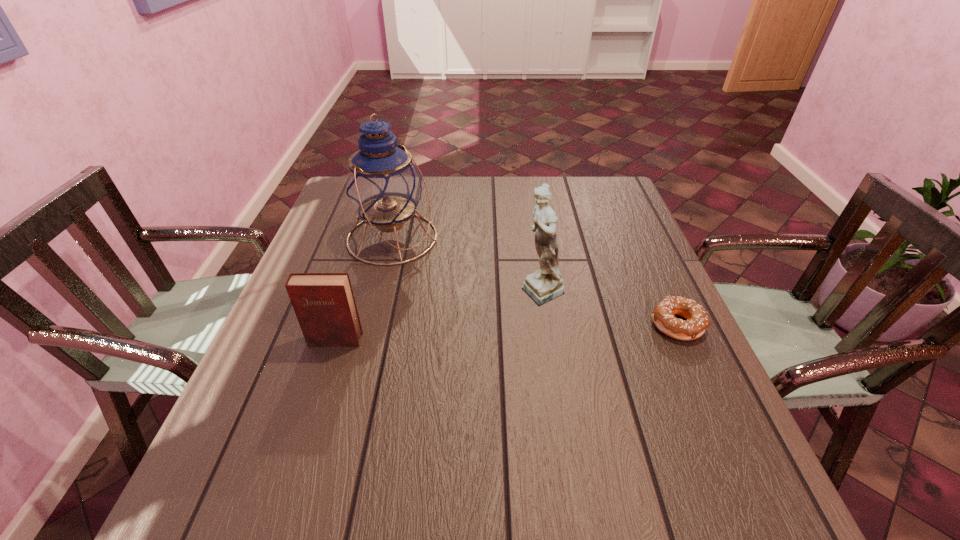
The image size is (960, 540). Identify the location of free space on the desktop that is between the diary and the rightmost object and is positioned on the front-facing side of the tallest object. (560, 330).

Locate an element on the screen. free spot on the desktop that is between the third tallest object and the shortest object and is positioned on the front-facing side of the second object from right to left is located at coordinates (462, 335).